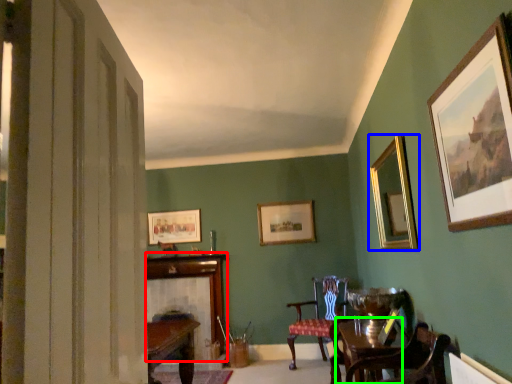
Question: Which object is the farthest from fireplace (highlighted by a red box)? Choose among these: picture frame (highlighted by a blue box) or round table (highlighted by a green box).

Choices:
 (A) picture frame
 (B) round table

Answer: (A)